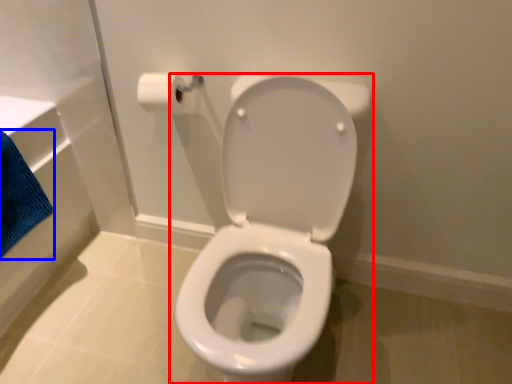
Question: Which object is further to the camera taking this photo, toilet (highlighted by a red box) or bath towel (highlighted by a blue box)?

Choices:
 (A) toilet
 (B) bath towel

Answer: (B)